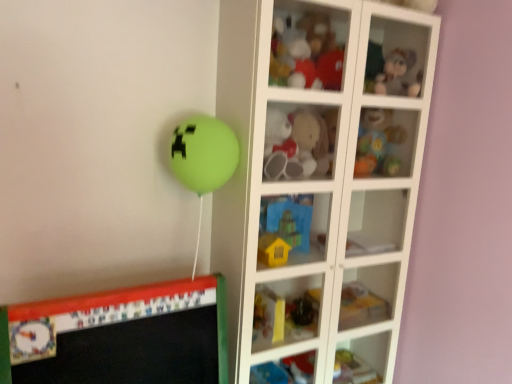
Question: Does fluffy plush toy at center, placed as the third toy when sorted from top to bottom, lie behind rubberized plastic baby rattle at upper right, positioned as the 5th toy in bottom-to-top order?

Choices:
 (A) yes
 (B) no

Answer: (B)

Question: Considering the relative sizes of fluffy plush toy at center, placed as the third toy when sorted from top to bottom, and rubberized plastic baby rattle at upper right, positioned as the 5th toy in bottom-to-top order, in the image provided, is fluffy plush toy at center, placed as the third toy when sorted from top to bottom, smaller than rubberized plastic baby rattle at upper right, positioned as the 5th toy in bottom-to-top order,?

Choices:
 (A) no
 (B) yes

Answer: (B)

Question: From a real-world perspective, is fluffy plush toy at center, placed as the third toy when sorted from top to bottom, physically above rubberized plastic baby rattle at upper right, which is the second toy in top-to-bottom order?

Choices:
 (A) no
 (B) yes

Answer: (B)

Question: Can you confirm if fluffy plush toy at center, placed as the third toy when sorted from top to bottom, is bigger than rubberized plastic baby rattle at upper right, positioned as the 5th toy in bottom-to-top order?

Choices:
 (A) no
 (B) yes

Answer: (A)

Question: From a real-world perspective, is fluffy plush toy at center, placed as the third toy when sorted from top to bottom, under rubberized plastic baby rattle at upper right, positioned as the 5th toy in bottom-to-top order?

Choices:
 (A) yes
 (B) no

Answer: (B)

Question: Would you say fluffy plush toy at center, placed as the third toy when sorted from top to bottom, is to the left or to the right of white glass cabinet at center in the picture?

Choices:
 (A) left
 (B) right

Answer: (A)

Question: Considering their positions, is fluffy plush toy at center, placed as the third toy when sorted from top to bottom, located in front of or behind white glass cabinet at center?

Choices:
 (A) behind
 (B) front

Answer: (A)

Question: Looking at their shapes, would you say fluffy plush toy at center, marked as the 4th toy in a bottom-to-top arrangement, is wider or thinner than white glass cabinet at center?

Choices:
 (A) wide
 (B) thin

Answer: (B)

Question: Is fluffy plush toy at center, placed as the third toy when sorted from top to bottom, situated inside white glass cabinet at center or outside?

Choices:
 (A) inside
 (B) outside

Answer: (A)

Question: Looking at the image, does rubberized plastic toy at lower center, which is counted as the 1th toy, starting from the bottom, seem bigger or smaller compared to yellow matte house at center, which appears as the 5th toy when viewed from the top?

Choices:
 (A) small
 (B) big

Answer: (B)

Question: From the image's perspective, is rubberized plastic toy at lower center, which is counted as the 1th toy, starting from the bottom, above or below yellow matte house at center, which appears as the 5th toy when viewed from the top?

Choices:
 (A) above
 (B) below

Answer: (B)

Question: Is rubberized plastic toy at lower center, which is counted as the 1th toy, starting from the bottom, taller or shorter than yellow matte house at center, which appears as the 5th toy when viewed from the top?

Choices:
 (A) short
 (B) tall

Answer: (A)

Question: Visually, is rubberized plastic toy at lower center, placed as the 6th toy when sorted from top to bottom, positioned to the left or to the right of yellow matte house at center, the 2th toy when ordered from bottom to top?

Choices:
 (A) right
 (B) left

Answer: (A)

Question: Considering the positions of yellow matte house at center, the 2th toy when ordered from bottom to top, and matte plastic teddy bear at upper center, the sixth toy when ordered from bottom to top, in the image, is yellow matte house at center, the 2th toy when ordered from bottom to top, wider or thinner than matte plastic teddy bear at upper center, the sixth toy when ordered from bottom to top,?

Choices:
 (A) wide
 (B) thin

Answer: (B)

Question: In terms of size, does yellow matte house at center, which appears as the 5th toy when viewed from the top, appear bigger or smaller than matte plastic teddy bear at upper center, the sixth toy when ordered from bottom to top?

Choices:
 (A) small
 (B) big

Answer: (A)